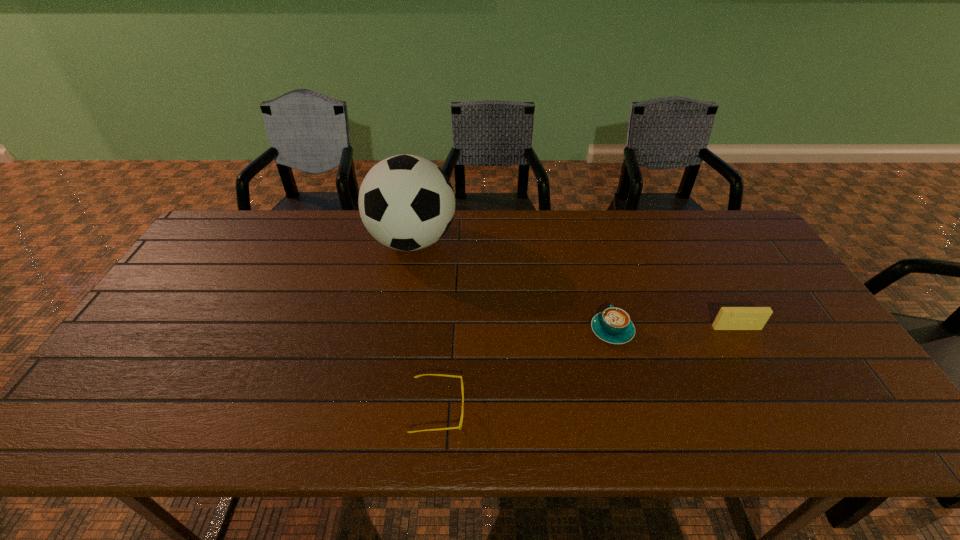
Locate an element on the screen. blank space located 0.090m with the handle on the right side of the cappuccino is located at coordinates (601, 292).

Image resolution: width=960 pixels, height=540 pixels. Find the location of `blank space located with the handle on the right side of the cappuccino`. blank space located with the handle on the right side of the cappuccino is located at coordinates (589, 250).

The image size is (960, 540). Identify the location of vacant region located 0.270m with the handle on the right side of the cappuccino. (589, 252).

This screenshot has height=540, width=960. I want to click on free space located in front of the lenses of the nearest object, so click(605, 410).

Identify the location of object at the far edge. Image resolution: width=960 pixels, height=540 pixels. (406, 202).

Identify the location of object that is at the near edge. click(x=459, y=427).

The width and height of the screenshot is (960, 540). In order to click on object that is at the right edge in this screenshot , I will do `click(728, 318)`.

Find the location of a particular element. This screenshot has height=540, width=960. free spot at the far edge of the desktop is located at coordinates (362, 241).

The image size is (960, 540). I want to click on blank space at the near edge, so click(x=233, y=438).

You are a GUI agent. You are given a task and a screenshot of the screen. Output one action in this format:
    pyautogui.click(x=<x>, y=<y>)
    Task: Click on the vacant space at the left edge of the desktop
    This screenshot has height=540, width=960.
    Given the screenshot: What is the action you would take?
    pyautogui.click(x=159, y=305)